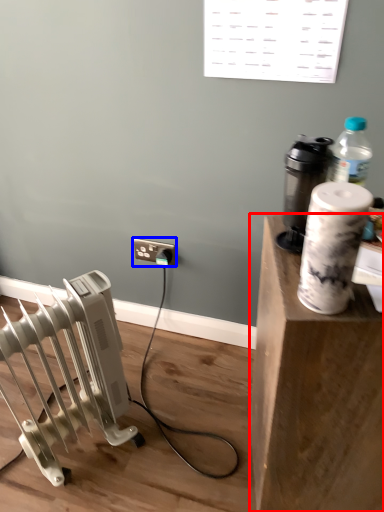
Question: Which object appears farthest to the camera in this image, furniture (highlighted by a red box) or electric outlet (highlighted by a blue box)?

Choices:
 (A) furniture
 (B) electric outlet

Answer: (B)